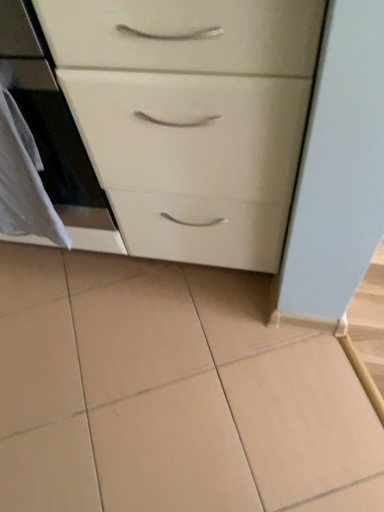
Question: Is white fabric at left a part of white glossy chest of drawers at center?

Choices:
 (A) no
 (B) yes

Answer: (B)

Question: From the image's perspective, would you say white glossy chest of drawers at center is shown under white fabric at left?

Choices:
 (A) yes
 (B) no

Answer: (B)

Question: Is white glossy chest of drawers at center to the right of white fabric at left from the viewer's perspective?

Choices:
 (A) no
 (B) yes

Answer: (B)

Question: Is white glossy chest of drawers at center smaller than white fabric at left?

Choices:
 (A) yes
 (B) no

Answer: (B)

Question: Is white glossy chest of drawers at center bigger than white fabric at left?

Choices:
 (A) yes
 (B) no

Answer: (A)

Question: Considering the positions of point (271, 71) and point (54, 166), is point (271, 71) closer or farther from the camera than point (54, 166)?

Choices:
 (A) farther
 (B) closer

Answer: (B)

Question: From the image's perspective, relative to white glossy oven at left, is white glossy chest of drawers at center above or below?

Choices:
 (A) above
 (B) below

Answer: (B)

Question: Looking at their shapes, would you say white glossy chest of drawers at center is wider or thinner than white glossy oven at left?

Choices:
 (A) wide
 (B) thin

Answer: (A)

Question: Do you think white glossy chest of drawers at center is within white glossy oven at left, or outside of it?

Choices:
 (A) inside
 (B) outside

Answer: (A)

Question: In terms of size, does white glossy oven at left appear bigger or smaller than white glossy chest of drawers at center?

Choices:
 (A) small
 (B) big

Answer: (A)

Question: Considering the relative positions of white glossy oven at left and white glossy chest of drawers at center in the image provided, is white glossy oven at left to the left or to the right of white glossy chest of drawers at center?

Choices:
 (A) left
 (B) right

Answer: (A)

Question: From a real-world perspective, is white glossy oven at left physically located above or below white glossy chest of drawers at center?

Choices:
 (A) above
 (B) below

Answer: (A)

Question: Considering the positions of white glossy oven at left and white glossy chest of drawers at center in the image, is white glossy oven at left taller or shorter than white glossy chest of drawers at center?

Choices:
 (A) short
 (B) tall

Answer: (A)

Question: From a real-world perspective, is white glossy chest of drawers at center physically located above or below white fabric at left?

Choices:
 (A) above
 (B) below

Answer: (B)

Question: Looking at their shapes, would you say white glossy chest of drawers at center is wider or thinner than white fabric at left?

Choices:
 (A) thin
 (B) wide

Answer: (B)